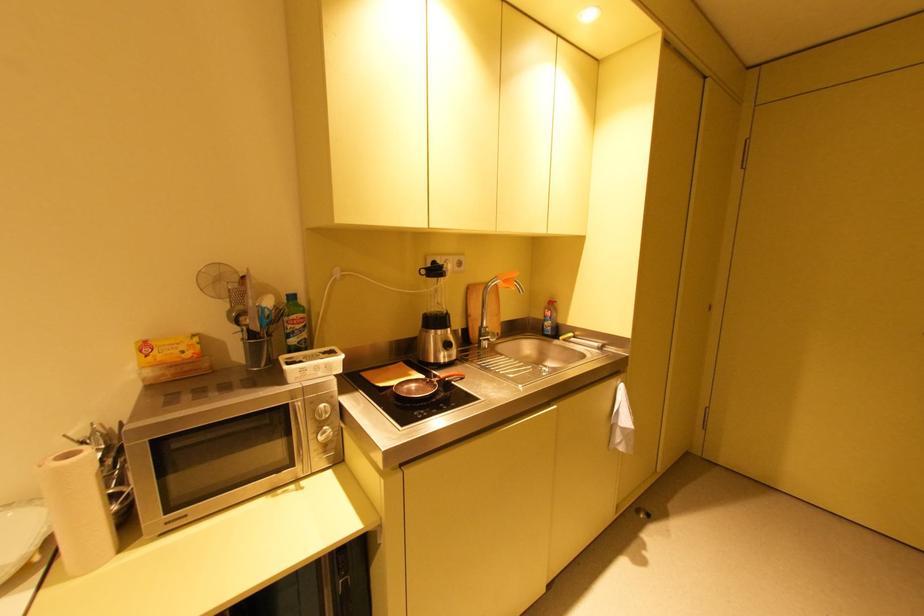
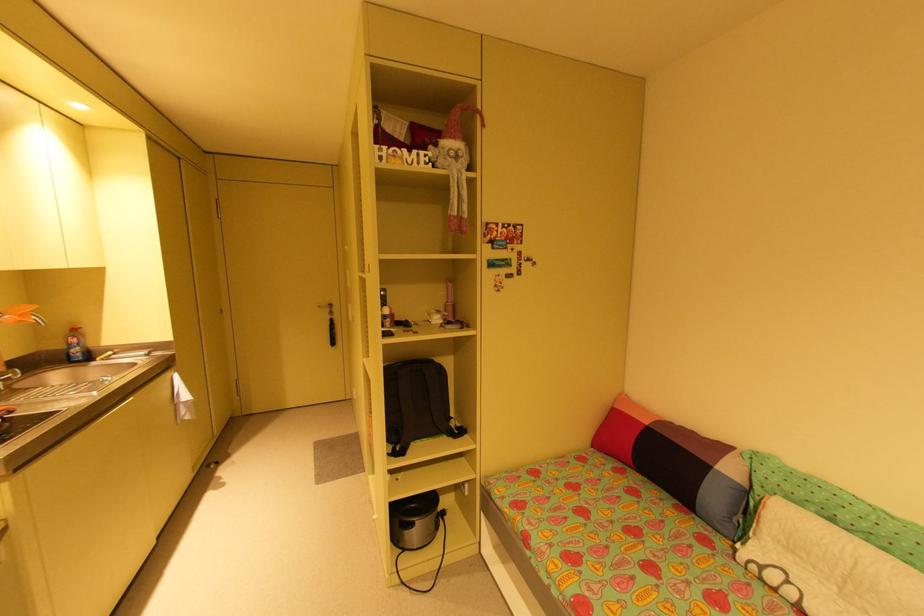
Where in the second image is the point corresponding to [555,302] from the first image?

(79, 331)